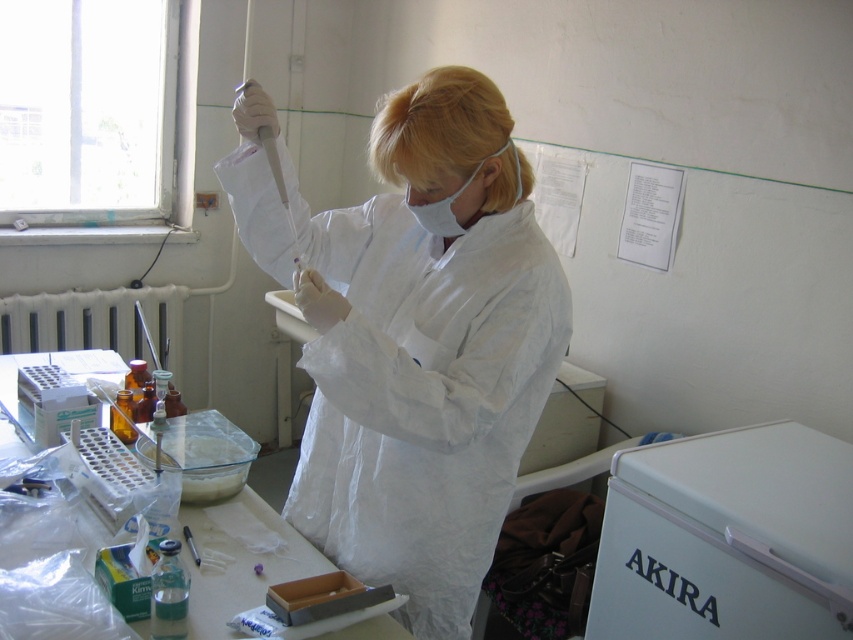
You are a researcher in the lab who needs to store a large batch of samples. You have a white plastic refrigerator at lower right and a clear plastic tray at center available. Which one would be more suitable for storing a large number of samples based on their sizes?

The white plastic refrigerator at lower right is larger in size than the clear plastic tray at center, so it can hold more samples and is more suitable for storing a large batch.